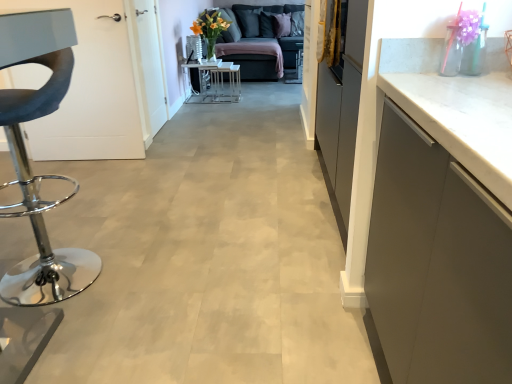
This screenshot has height=384, width=512. What do you see at coordinates (257, 42) in the screenshot? I see `dark gray fabric couch at upper center` at bounding box center [257, 42].

Describe the element at coordinates (213, 83) in the screenshot. The height and width of the screenshot is (384, 512). I see `metallic silver table at center` at that location.

Where is `metallic chrome stool at left`? Image resolution: width=512 pixels, height=384 pixels. metallic chrome stool at left is located at coordinates (28, 160).

The width and height of the screenshot is (512, 384). What are the coordinates of `dark gray fabric couch at upper center` in the screenshot? It's located at (257, 42).

How many degrees apart are the facing directions of metallic silver table at center and metallic chrome stool at left?

86.8 degrees separate the facing orientations of metallic silver table at center and metallic chrome stool at left.

Is metallic silver table at center oriented away from metallic chrome stool at left?

No, metallic chrome stool at left is not at the back of metallic silver table at center.

Is metallic silver table at center outside of metallic chrome stool at left?

Absolutely, metallic silver table at center is external to metallic chrome stool at left.

What's the angular difference between metallic chrome stool at left and dark gray fabric couch at upper center's facing directions?

metallic chrome stool at left and dark gray fabric couch at upper center are facing 1.57 degrees away from each other.

Which object is more forward, metallic chrome stool at left or dark gray fabric couch at upper center?

Positioned in front is metallic chrome stool at left.

Who is shorter, metallic chrome stool at left or dark gray fabric couch at upper center?

Standing shorter between the two is dark gray fabric couch at upper center.

Identify the location of furniture on the left of dark gray fabric couch at upper center. This screenshot has height=384, width=512. [28, 160].

Can you tell me how much metallic chrome stool at left and metallic silver table at center differ in facing direction?

metallic chrome stool at left and metallic silver table at center are facing 86.8 degrees away from each other.

Considering the positions of objects metallic chrome stool at left and metallic silver table at center in the image provided, who is more to the right, metallic chrome stool at left or metallic silver table at center?

metallic silver table at center.

Is metallic chrome stool at left further to camera compared to metallic silver table at center?

No.

From a real-world perspective, is dark gray fabric couch at upper center under metallic chrome stool at left?

Yes, from a real-world perspective, dark gray fabric couch at upper center is beneath metallic chrome stool at left.

Can you confirm if dark gray fabric couch at upper center is positioned to the right of metallic chrome stool at left?

Yes, dark gray fabric couch at upper center is to the right of metallic chrome stool at left.

Is dark gray fabric couch at upper center taller than metallic chrome stool at left?

No, dark gray fabric couch at upper center is not taller than metallic chrome stool at left.

Does dark gray fabric couch at upper center have a larger size compared to metallic chrome stool at left?

Yes.

Is dark gray fabric couch at upper center smaller than metallic silver table at center?

No.

Based on the photo, measure the distance from dark gray fabric couch at upper center to metallic silver table at center.

The distance of dark gray fabric couch at upper center from metallic silver table at center is 86.58 centimeters.

Considering the sizes of objects dark gray fabric couch at upper center and metallic silver table at center in the image provided, who is wider, dark gray fabric couch at upper center or metallic silver table at center?

dark gray fabric couch at upper center is wider.

Looking at this image, are dark gray fabric couch at upper center and metallic silver table at center far apart?

No.

From the picture: Which object is further away from the camera taking this photo, metallic silver table at center or dark gray fabric couch at upper center?

Positioned behind is dark gray fabric couch at upper center.

From a real-world perspective, does metallic silver table at center sit lower than dark gray fabric couch at upper center?

Correct, in the physical world, metallic silver table at center is lower than dark gray fabric couch at upper center.

Considering the positions of objects metallic silver table at center and dark gray fabric couch at upper center in the image provided, who is more to the left, metallic silver table at center or dark gray fabric couch at upper center?

Positioned to the left is metallic silver table at center.

Would you say dark gray fabric couch at upper center is part of metallic silver table at center's contents?

No, metallic silver table at center does not contain dark gray fabric couch at upper center.

Where is `table that is on the right side of metallic chrome stool at left`? The height and width of the screenshot is (384, 512). table that is on the right side of metallic chrome stool at left is located at coordinates (213, 83).

This screenshot has height=384, width=512. What are the coordinates of `furniture in front of the dark gray fabric couch at upper center` in the screenshot? It's located at (28, 160).

When comparing their distances from metallic chrome stool at left, does metallic silver table at center or dark gray fabric couch at upper center seem further?

Among the two, dark gray fabric couch at upper center is located further to metallic chrome stool at left.

Based on the photo, considering their positions, is metallic chrome stool at left positioned closer to dark gray fabric couch at upper center than metallic silver table at center?

Based on the image, metallic silver table at center appears to be nearer to dark gray fabric couch at upper center.

Looking at the image, which one is located further to metallic silver table at center, dark gray fabric couch at upper center or metallic chrome stool at left?

metallic chrome stool at left is further to metallic silver table at center.

Based on their spatial positions, is dark gray fabric couch at upper center or metallic silver table at center further from metallic chrome stool at left?

dark gray fabric couch at upper center is further to metallic chrome stool at left.

From the image, which object appears to be nearer to metallic silver table at center, metallic chrome stool at left or dark gray fabric couch at upper center?

The object closer to metallic silver table at center is dark gray fabric couch at upper center.

Based on their spatial positions, is metallic silver table at center or metallic chrome stool at left further from dark gray fabric couch at upper center?

Based on the image, metallic chrome stool at left appears to be further to dark gray fabric couch at upper center.

Find the location of a particular element. Image resolution: width=512 pixels, height=384 pixels. table between metallic chrome stool at left and dark gray fabric couch at upper center from front to back is located at coordinates (213, 83).